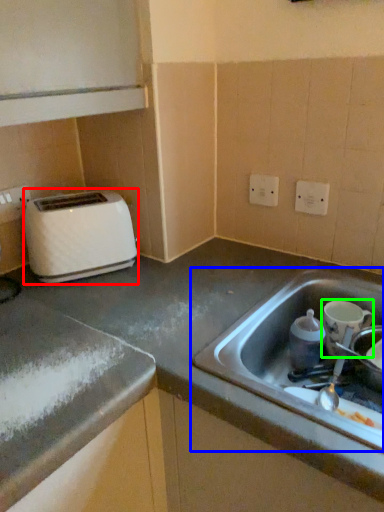
Question: Based on their relative distances, which object is nearer to toaster (highlighted by a red box)? Choose from sink (highlighted by a blue box) and appliance (highlighted by a green box).

Choices:
 (A) sink
 (B) appliance

Answer: (A)